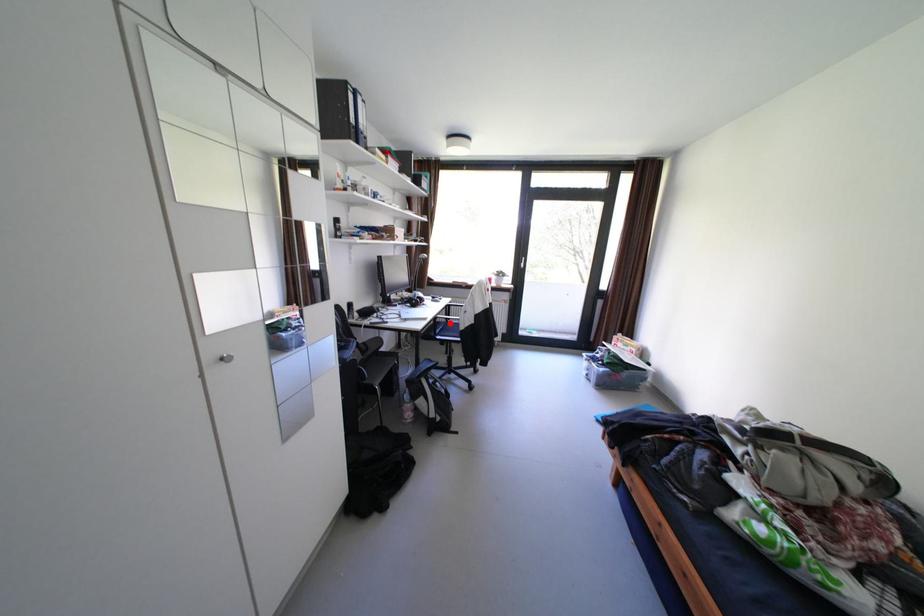
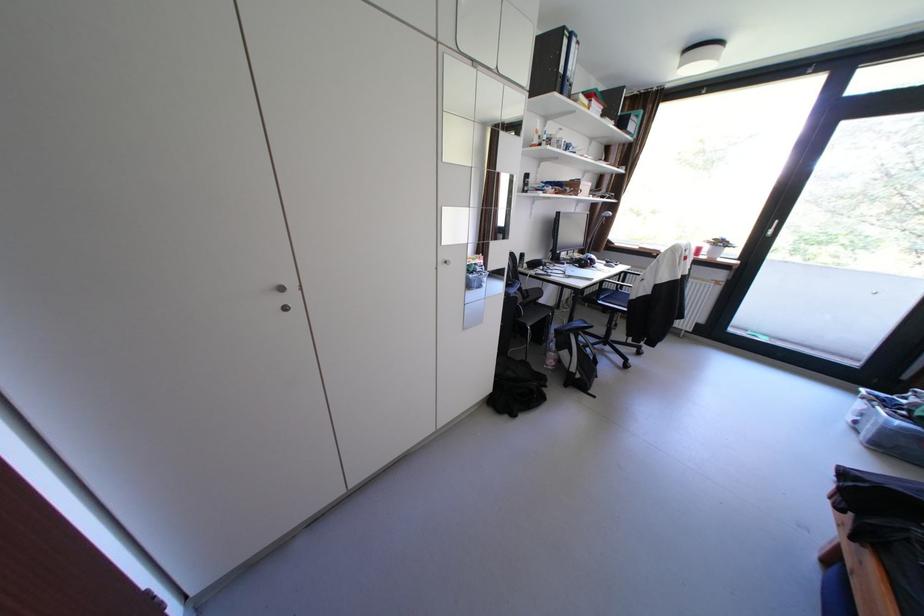
Find the pixel in the second image that matches the highlighted location in the first image.

(617, 290)